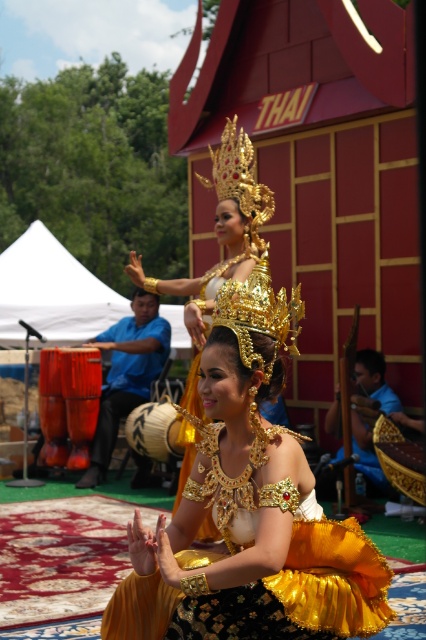
In the scene shown: Which of these two, golden silk dress at center or gold metallic headdress at center, stands taller?

Standing taller between the two is gold metallic headdress at center.

The image size is (426, 640). I want to click on golden silk dress at center, so click(x=250, y=509).

Where is `golden silk dress at center`? This screenshot has height=640, width=426. golden silk dress at center is located at coordinates (250, 509).

I want to click on golden silk dress at center, so point(250,509).